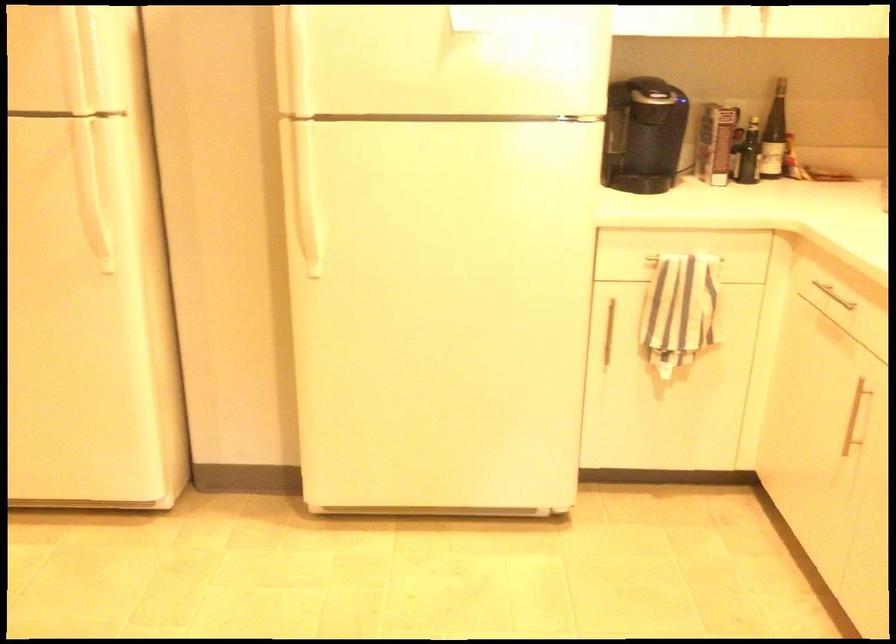
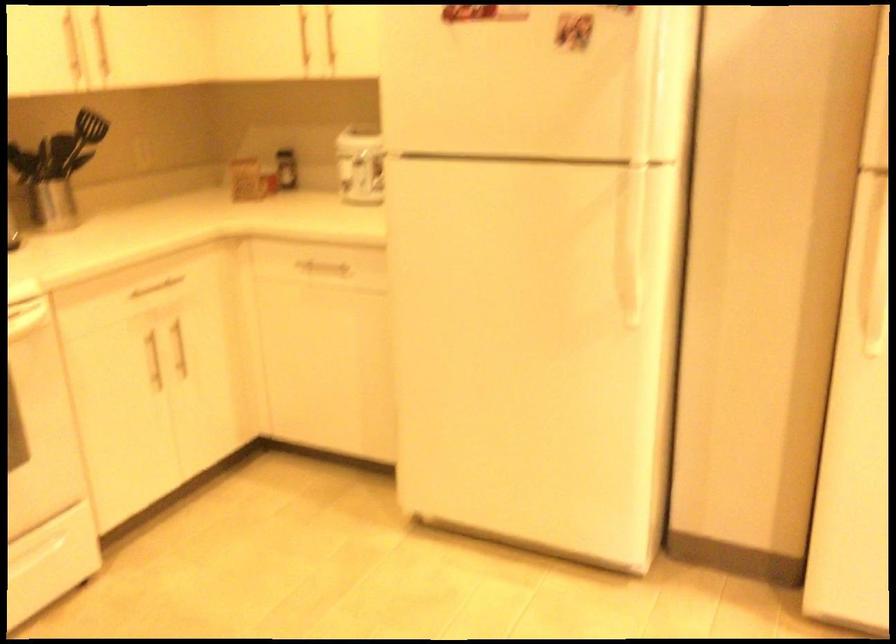
The point at [99,225] is marked in the first image. Where is the corresponding point in the second image?

(634, 277)